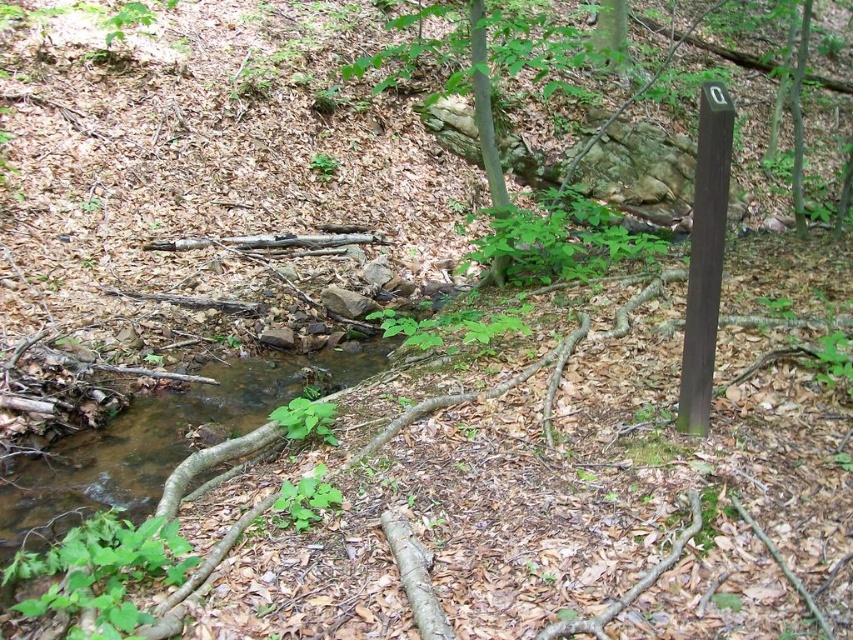
Question: Which object is closer to the camera taking this photo?

Choices:
 (A) clear water stream at center
 (B) brown smooth pole at right

Answer: (B)

Question: Is clear water stream at center to the right of brown smooth pole at right from the viewer's perspective?

Choices:
 (A) yes
 (B) no

Answer: (B)

Question: Does clear water stream at center have a lesser width compared to brown smooth pole at right?

Choices:
 (A) yes
 (B) no

Answer: (B)

Question: Does clear water stream at center have a lesser width compared to brown smooth pole at right?

Choices:
 (A) no
 (B) yes

Answer: (A)